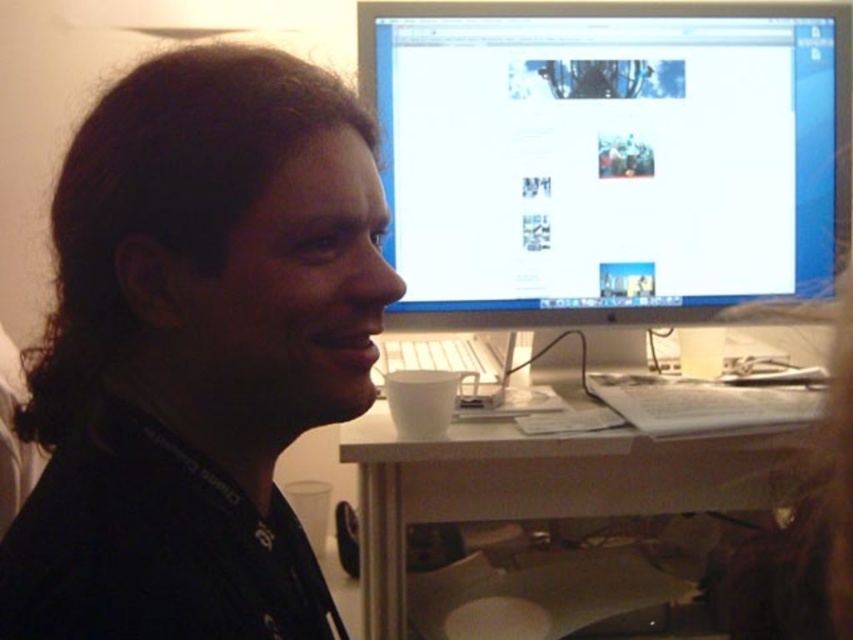
Question: Does black matte shirt at center come behind matte black monitor at upper right?

Choices:
 (A) no
 (B) yes

Answer: (A)

Question: Does black matte shirt at center appear on the left side of white plastic desk at lower center?

Choices:
 (A) yes
 (B) no

Answer: (A)

Question: Which is nearer to the white plastic desk at lower center?

Choices:
 (A) black matte shirt at center
 (B) matte black monitor at upper right

Answer: (B)

Question: Which point is farther to the camera?

Choices:
 (A) (383, 416)
 (B) (525, 61)
 (C) (160, 458)

Answer: (B)

Question: Is black matte shirt at center closer to camera compared to white plastic desk at lower center?

Choices:
 (A) yes
 (B) no

Answer: (A)

Question: Considering the real-world distances, which object is closest to the matte black monitor at upper right?

Choices:
 (A) black matte shirt at center
 (B) white plastic desk at lower center

Answer: (B)